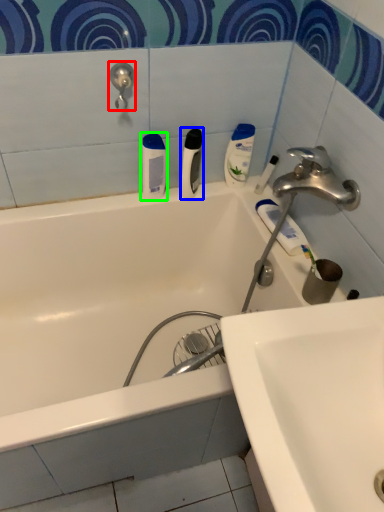
Question: Considering the real-world distances, which object is closest to shower (highlighted by a red box)? toiletry (highlighted by a blue box) or toiletry (highlighted by a green box).

Choices:
 (A) toiletry
 (B) toiletry

Answer: (B)